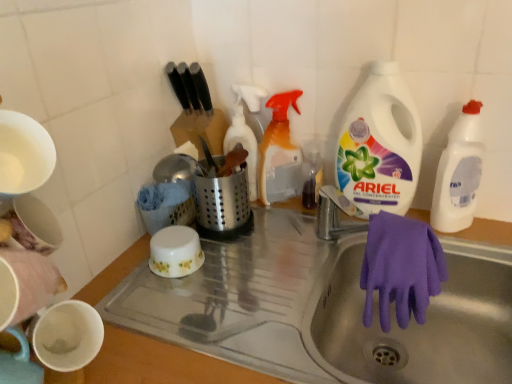
This screenshot has height=384, width=512. I want to click on vacant space situated on the left part of white plastic bottle at upper right, the second cleaning product viewed from the right, so click(316, 238).